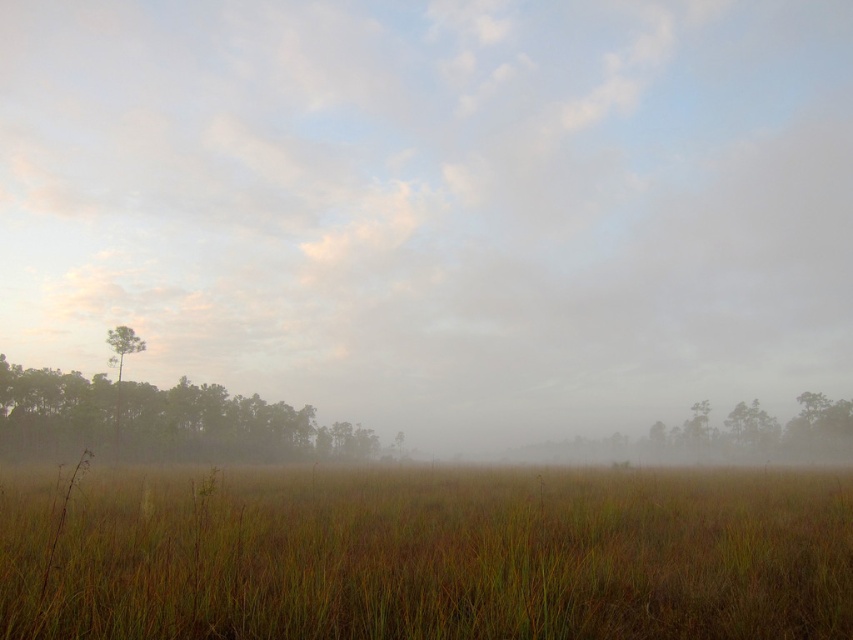
Question: Which of the following is the farthest from the observer?

Choices:
 (A) green matte tree at left
 (B) green matte tree at center
 (C) brown grassy at center
 (D) foggy grassland at lower center

Answer: (B)

Question: Which object appears farthest from the camera in this image?

Choices:
 (A) green matte tree at center
 (B) green matte tree at left

Answer: (A)

Question: Which point is farther to the camera?

Choices:
 (A) (263, 620)
 (B) (749, 445)
 (C) (317, 144)
 (D) (134, 449)

Answer: (C)

Question: From the image, what is the correct spatial relationship of green matte tree at left in relation to green matte tree at center?

Choices:
 (A) left
 (B) right

Answer: (A)

Question: From the image, what is the correct spatial relationship of brown grassy at center in relation to green matte tree at center?

Choices:
 (A) below
 (B) above

Answer: (B)

Question: Is foggy grassland at lower center bigger than green matte tree at left?

Choices:
 (A) no
 (B) yes

Answer: (B)